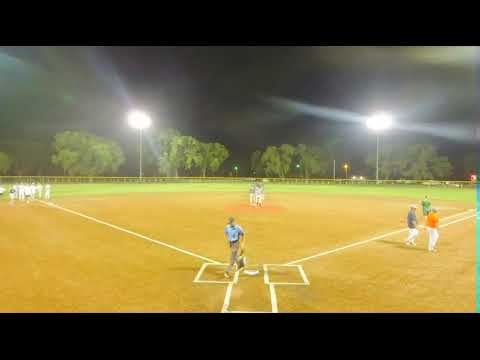
Where is `light`? The height and width of the screenshot is (360, 480). light is located at coordinates (135, 114).